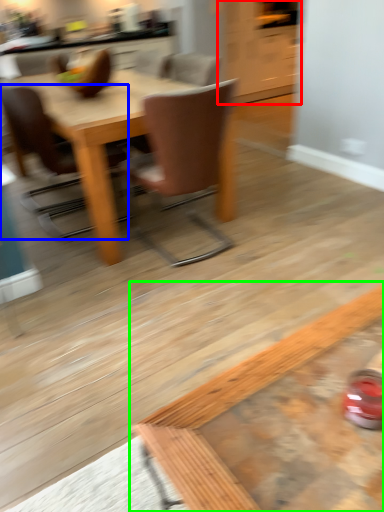
Question: Considering the real-world distances, which object is farthest from cabinetry (highlighted by a red box)? chair (highlighted by a blue box) or coffee table (highlighted by a green box)?

Choices:
 (A) chair
 (B) coffee table

Answer: (B)